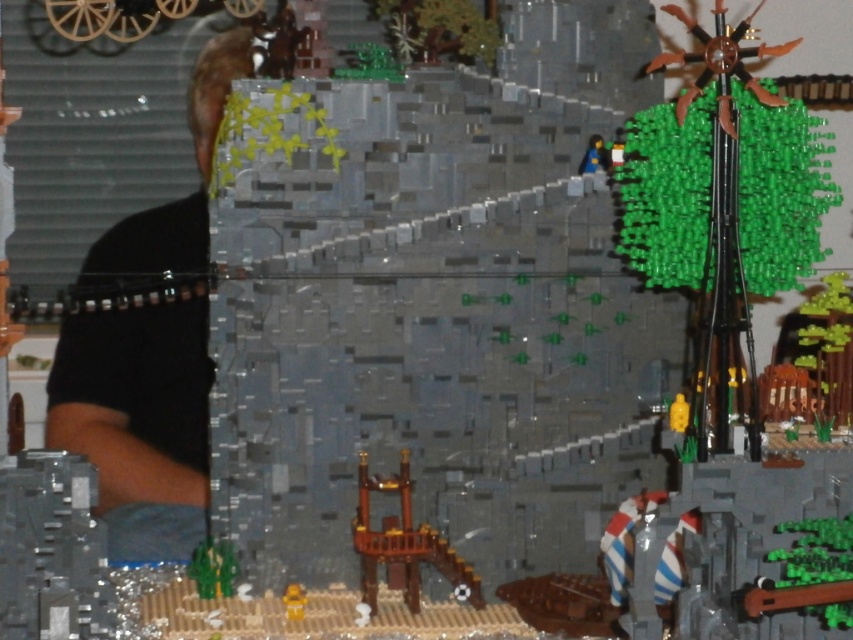
Question: Is black matte shirt at left above yellow matte figure at lower center?

Choices:
 (A) no
 (B) yes

Answer: (B)

Question: Estimate the real-world distances between objects in this image. Which object is closer to the black matte shirt at left?

Choices:
 (A) brown wooden tower at center
 (B) yellow matte figure at lower center

Answer: (A)

Question: Which of these objects is positioned closest to the brown wooden tower at center?

Choices:
 (A) yellow matte figure at lower center
 (B) black matte shirt at left

Answer: (A)

Question: Which object is closer to the camera taking this photo?

Choices:
 (A) yellow matte figure at lower center
 (B) brown wooden tower at center
 (C) black matte shirt at left
 (D) blue plastic figure at upper center

Answer: (C)

Question: From the image, what is the correct spatial relationship of black matte shirt at left in relation to yellow matte figure at lower center?

Choices:
 (A) above
 (B) below

Answer: (A)

Question: Does black matte shirt at left appear on the right side of blue plastic figure at upper center?

Choices:
 (A) no
 (B) yes

Answer: (A)